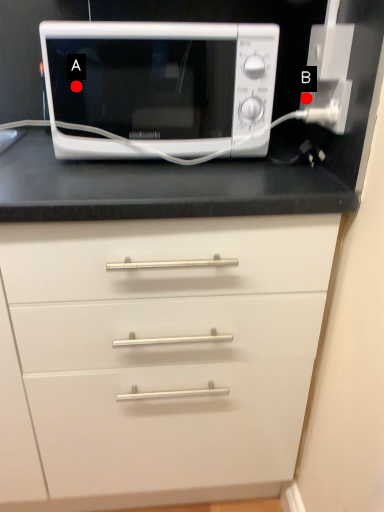
Question: Two points are circled on the image, labeled by A and B beside each circle. Among these points, which one is nearest to the camera?

Choices:
 (A) A is closer
 (B) B is closer

Answer: (A)